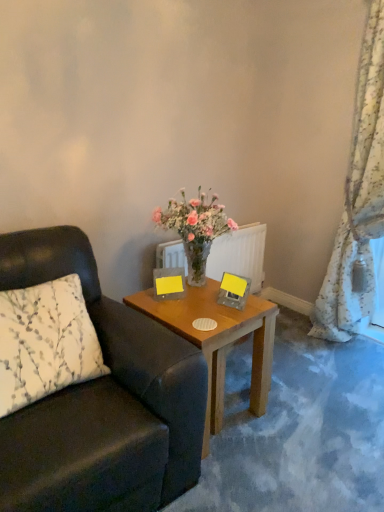
Find the location of `vacant area on top of wooden table at center (from a real-world perspective)`. vacant area on top of wooden table at center (from a real-world perspective) is located at coordinates (200, 304).